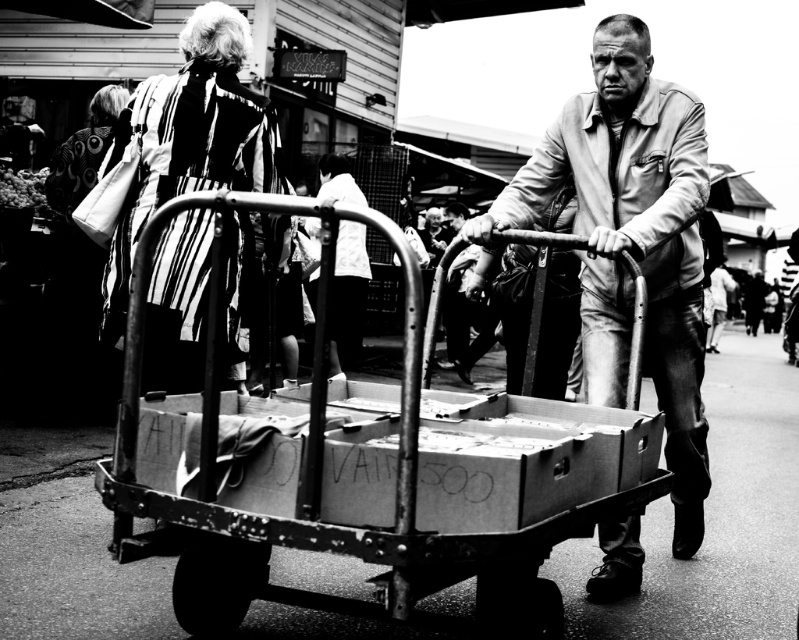
You are a photographer analyzing this black and white photo. You need to place a rectangular highlight box around the matte leather jacket at center. What are the coordinates for the center of this highlight box?

The center of the highlight box should be placed at coordinates point (631, 241), as that is the 2D location of the matte leather jacket at center.

You are a photographer analyzing this black and white photo. You notice the metallic cart at center and the white fabric shirt at center. Which object appears closer to you in the image?

The metallic cart at center is closer to the viewer than the white fabric shirt at center.

You are standing at the origin point of the image. Where is the metallic cart at center located in terms of coordinates?

The metallic cart at center is located at coordinates point (360,472).